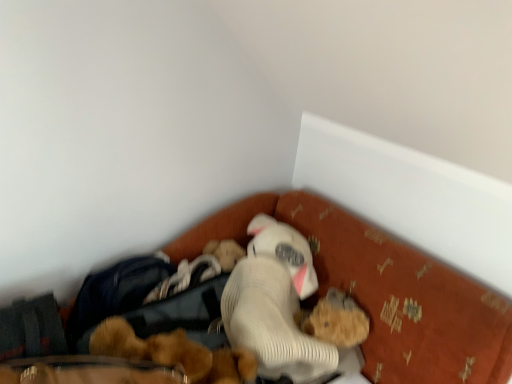
Question: Choose the correct answer: Is fuzzy brown teddy bear at lower center, acting as the second toy starting from the left, inside white ribbed plush at center or outside it?

Choices:
 (A) outside
 (B) inside

Answer: (B)

Question: Relative to white ribbed plush at center, is fuzzy brown teddy bear at lower center, placed as the 1th toy when sorted from right to left, in front or behind?

Choices:
 (A) behind
 (B) front

Answer: (A)

Question: Which is nearer to the white ribbed plush at center?

Choices:
 (A) fuzzy brown teddy bear at lower center, acting as the second toy starting from the left
 (B) fluffy brown teddy bear at center, the second toy when ordered from right to left
 (C) velvet orange bed at lower center

Answer: (A)

Question: Estimate the real-world distances between objects in this image. Which object is farther from the white ribbed plush at center?

Choices:
 (A) velvet orange bed at lower center
 (B) fuzzy brown teddy bear at lower center, placed as the 1th toy when sorted from right to left
 (C) fluffy brown teddy bear at center, the second toy when ordered from right to left

Answer: (A)